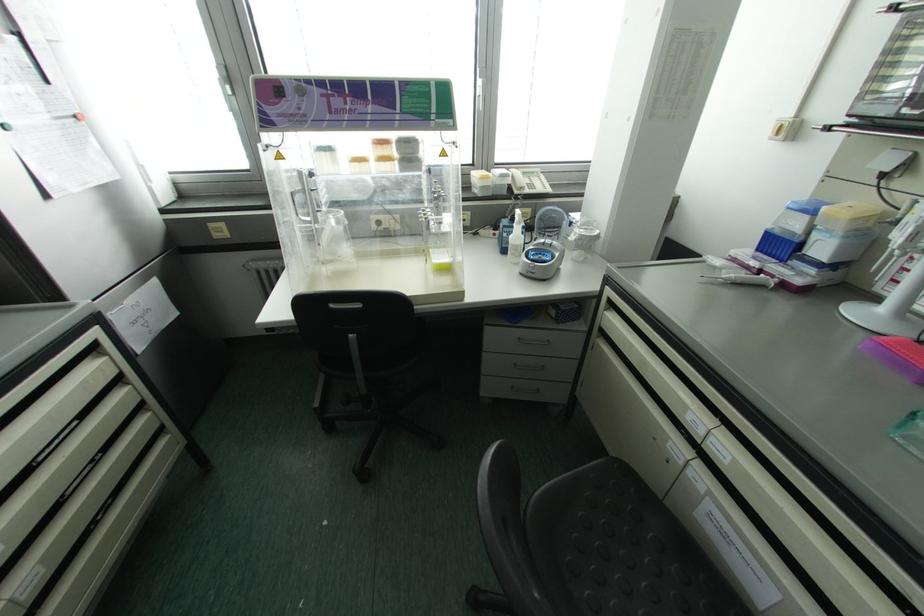
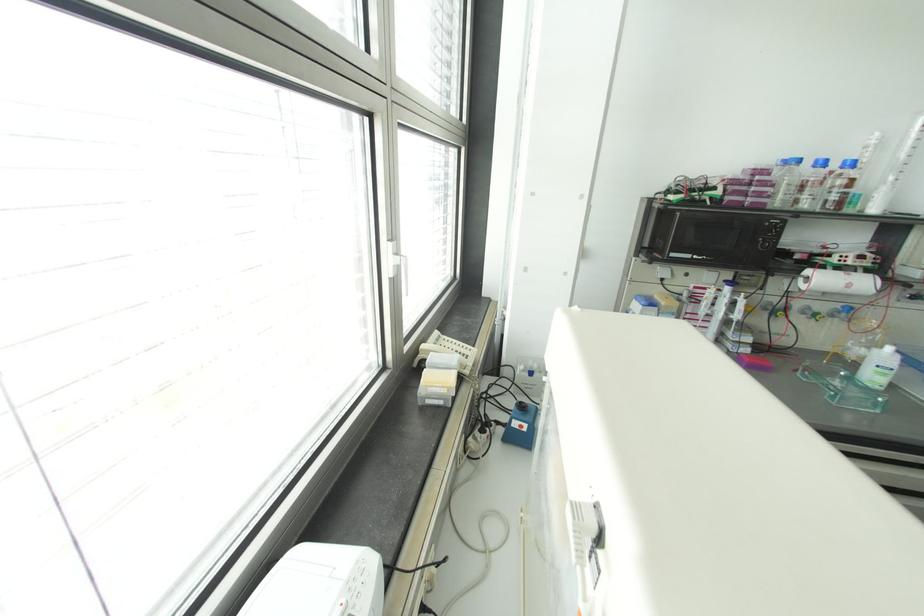
Question: I am providing you with two images of the same scene from different viewpoints. Please identify which objects are invisible in image2.

Choices:
 (A) black chair sitting surface
 (B) toilet paper holder cover
 (C) white wash bottle
 (D) white window handle

Answer: (A)